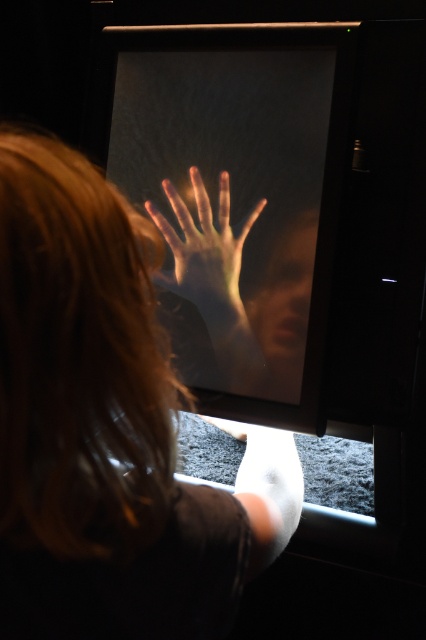
Question: Which object is the closest to the smooth skin face at center?

Choices:
 (A) translucent flesh at center
 (B) smooth skin hand at center

Answer: (A)

Question: Does translucent flesh at center appear under smooth skin face at center?

Choices:
 (A) yes
 (B) no

Answer: (B)

Question: Which point appears farthest from the camera in this image?

Choices:
 (A) (80, 161)
 (B) (238, 129)
 (C) (279, 269)
 (D) (192, 253)

Answer: (D)

Question: Estimate the real-world distances between objects in this image. Which object is farther from the smooth skin face at center?

Choices:
 (A) smooth skin hand at center
 (B) translucent flesh at center

Answer: (A)

Question: Is transparent glass screen at center below smooth skin face at center?

Choices:
 (A) no
 (B) yes

Answer: (A)

Question: Considering the relative positions of smooth skin hand at center and translucent flesh at center in the image provided, where is smooth skin hand at center located with respect to translucent flesh at center?

Choices:
 (A) right
 (B) left

Answer: (B)